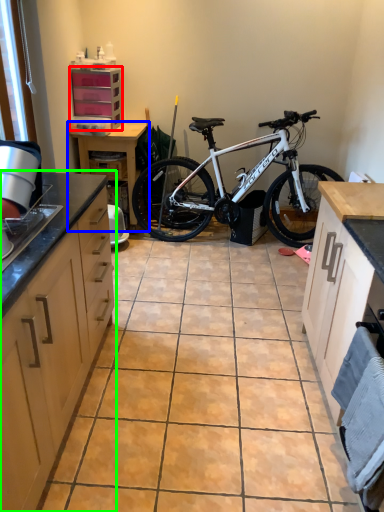
Question: Which object is positioned farthest from cabinetry (highlighted by a red box)? Select from table (highlighted by a blue box) and cabinetry (highlighted by a green box).

Choices:
 (A) table
 (B) cabinetry

Answer: (B)